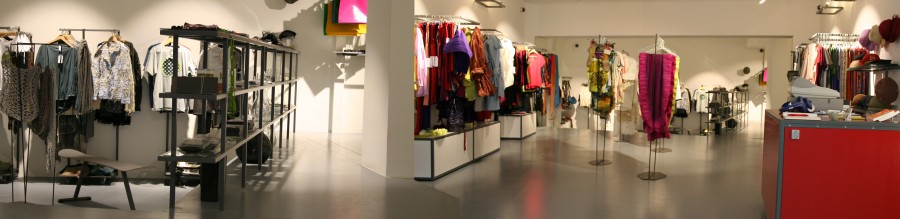
This screenshot has width=900, height=219. I want to click on red checkout counter, so click(x=814, y=173).